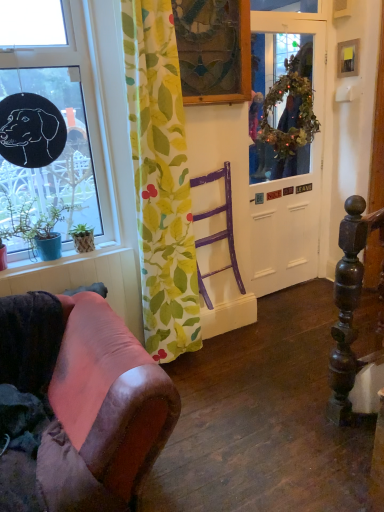
Question: From a real-world perspective, is smooth wood window sill at lower left positioned over black matte window at upper left based on gravity?

Choices:
 (A) yes
 (B) no

Answer: (B)

Question: Is smooth wood window sill at lower left oriented towards black matte window at upper left?

Choices:
 (A) yes
 (B) no

Answer: (B)

Question: From a real-world perspective, is smooth wood window sill at lower left beneath black matte window at upper left?

Choices:
 (A) no
 (B) yes

Answer: (B)

Question: Is smooth wood window sill at lower left next to black matte window at upper left?

Choices:
 (A) no
 (B) yes

Answer: (A)

Question: From the image's perspective, is smooth wood window sill at lower left below black matte window at upper left?

Choices:
 (A) yes
 (B) no

Answer: (A)

Question: Does smooth wood window sill at lower left have a greater width compared to black matte window at upper left?

Choices:
 (A) yes
 (B) no

Answer: (B)

Question: Does wooden picture frame at upper right, acting as the first picture frame starting from the right, have a lesser height compared to green leafy fabric curtain at center?

Choices:
 (A) no
 (B) yes

Answer: (B)

Question: From the image's perspective, is wooden picture frame at upper right, acting as the first picture frame starting from the right, under green leafy fabric curtain at center?

Choices:
 (A) no
 (B) yes

Answer: (A)

Question: Considering the relative sizes of wooden picture frame at upper right, positioned as the 2th picture frame in left-to-right order, and green leafy fabric curtain at center in the image provided, is wooden picture frame at upper right, positioned as the 2th picture frame in left-to-right order, bigger than green leafy fabric curtain at center?

Choices:
 (A) no
 (B) yes

Answer: (A)

Question: Is wooden picture frame at upper right, acting as the first picture frame starting from the right, taller than green leafy fabric curtain at center?

Choices:
 (A) yes
 (B) no

Answer: (B)

Question: Is wooden picture frame at upper right, placed as the first picture frame when sorted from back to front, outside of green leafy fabric curtain at center?

Choices:
 (A) no
 (B) yes

Answer: (B)

Question: Is wooden picture frame at upper right, the second picture frame when ordered from front to back, surrounding green leafy fabric curtain at center?

Choices:
 (A) yes
 (B) no

Answer: (B)

Question: From a real-world perspective, is green leafy fabric curtain at center physically below stained glass picture frame at upper center, which is the second picture frame in back-to-front order?

Choices:
 (A) no
 (B) yes

Answer: (B)